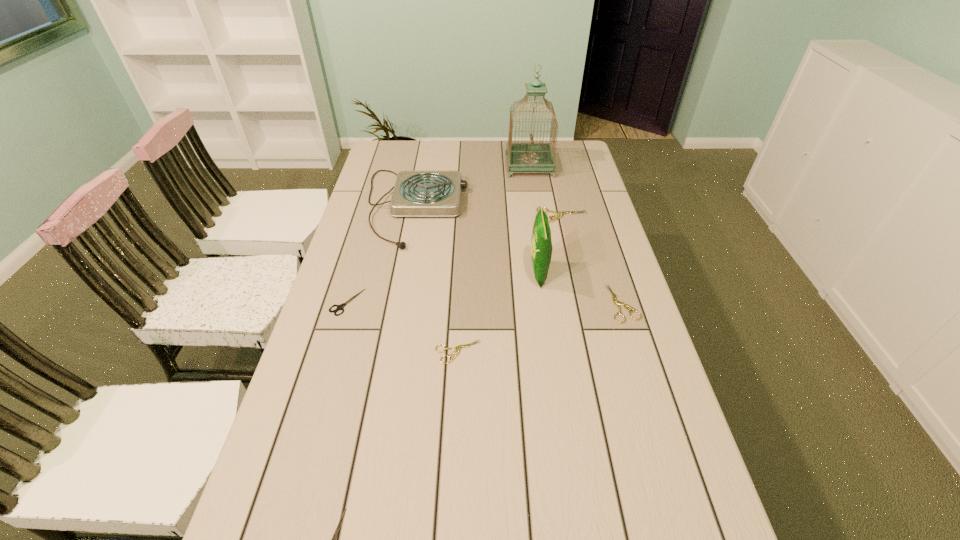
You are a GUI agent. You are given a task and a screenshot of the screen. Output one action in this format:
    pyautogui.click(x=<x>, y=<y>)
    Task: Click on the vacant space at the right edge of the desktop
    
    Given the screenshot: What is the action you would take?
    pyautogui.click(x=581, y=247)

Locate an element on the screen. This screenshot has width=960, height=540. free space at the far left corner of the desktop is located at coordinates (378, 144).

Where is `free location at the far right corner`? free location at the far right corner is located at coordinates (557, 146).

This screenshot has height=540, width=960. I want to click on free space between the leftmost shears and the third tallest object, so click(x=381, y=254).

The image size is (960, 540). What are the coordinates of `vacant region between the third tallest object and the farthest shears` in the screenshot? It's located at (489, 211).

In order to click on free space that is in between the third tallest object and the second smallest beige shears in this screenshot , I will do `click(519, 255)`.

Identify the location of vacant space that's between the bigger black shears and the seventh shortest object. (443, 287).

Where is `vacant area that lies between the birdcage and the hotplate`? This screenshot has width=960, height=540. vacant area that lies between the birdcage and the hotplate is located at coordinates (472, 186).

Find the location of `empty location between the birdcage and the second nearest beige shears`. empty location between the birdcage and the second nearest beige shears is located at coordinates (576, 234).

Identify the location of object that can be found as the seventh closest to the crisp (potato chip). This screenshot has width=960, height=540. (336, 532).